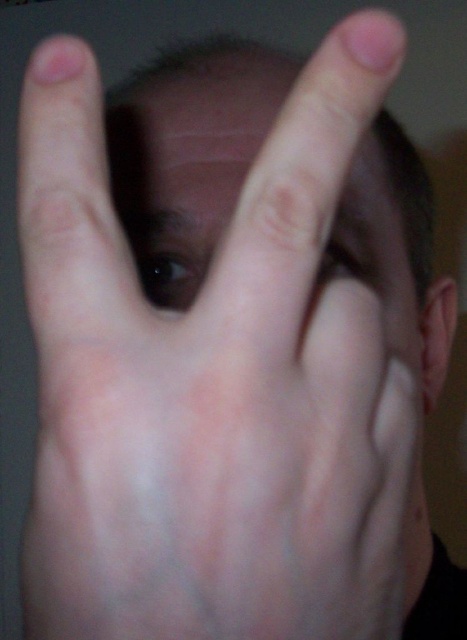
Question: Is black glossy eye at center further to the viewer compared to matte skin eye at center?

Choices:
 (A) yes
 (B) no

Answer: (A)

Question: Among these objects, which one is farthest from the camera?

Choices:
 (A) matte skin eye at center
 (B) black glossy eye at center

Answer: (B)

Question: Can you confirm if black glossy eye at center is bigger than matte skin eye at center?

Choices:
 (A) no
 (B) yes

Answer: (A)

Question: Is black glossy eye at center wider than matte skin eye at center?

Choices:
 (A) yes
 (B) no

Answer: (B)

Question: Which point is closer to the camera?

Choices:
 (A) matte skin eye at center
 (B) black glossy eye at center

Answer: (A)